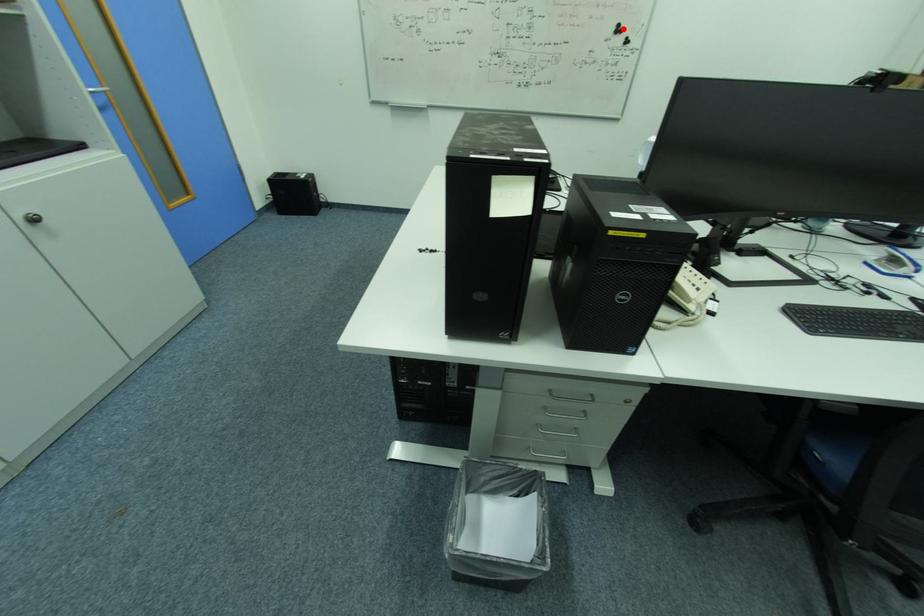
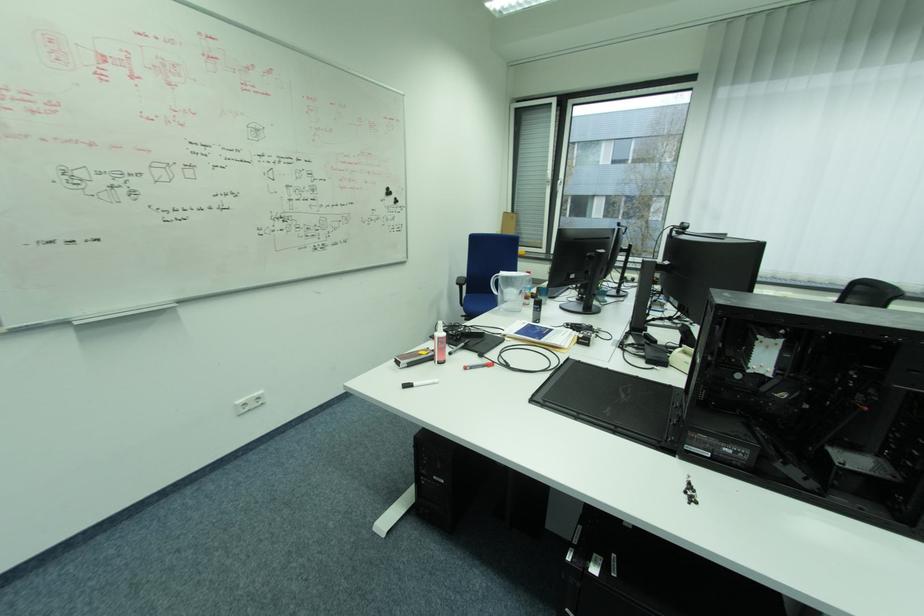
Locate, in the second image, the point that corresponds to the highlighted location in the first image.

(392, 192)